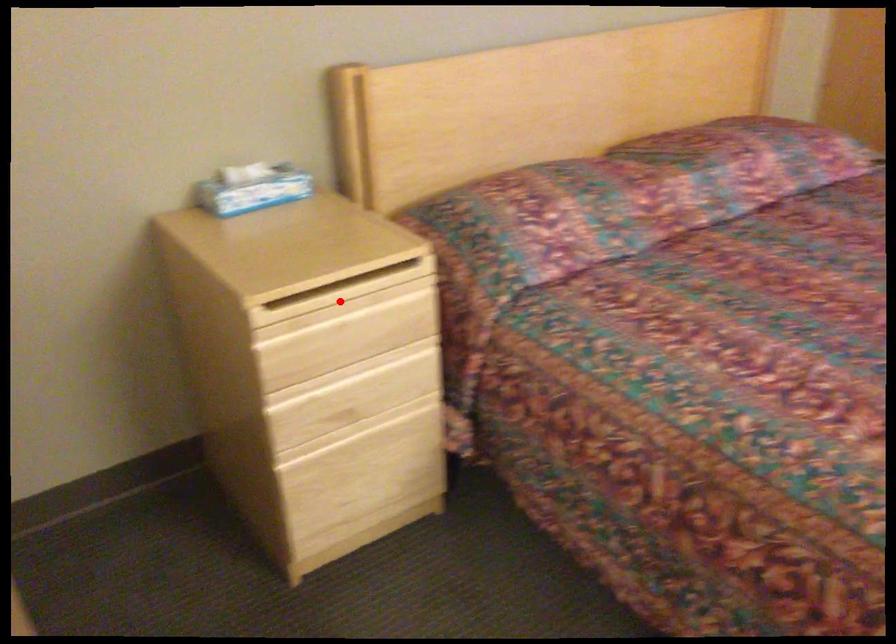
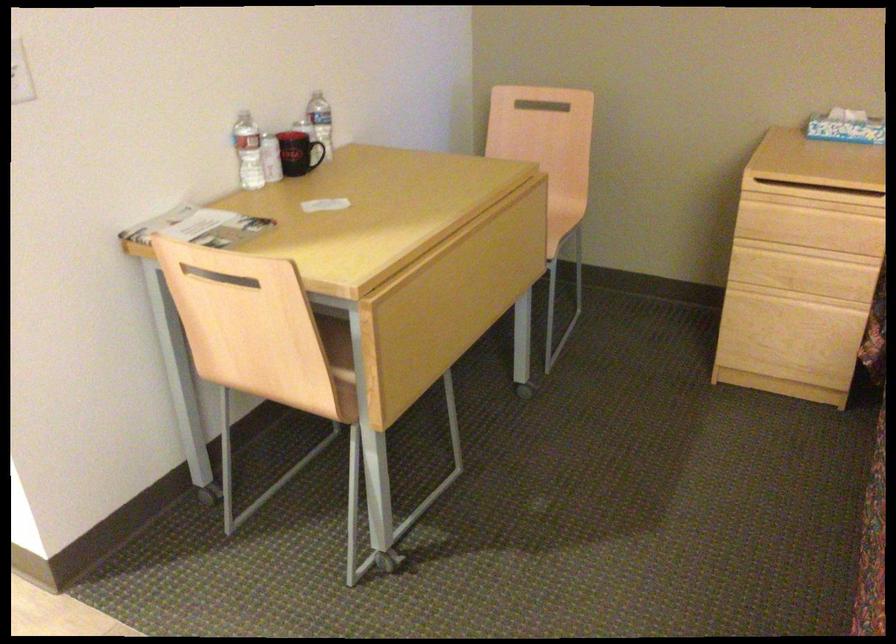
The point at the highlighted location is marked in the first image. Where is the corresponding point in the second image?

(814, 196)